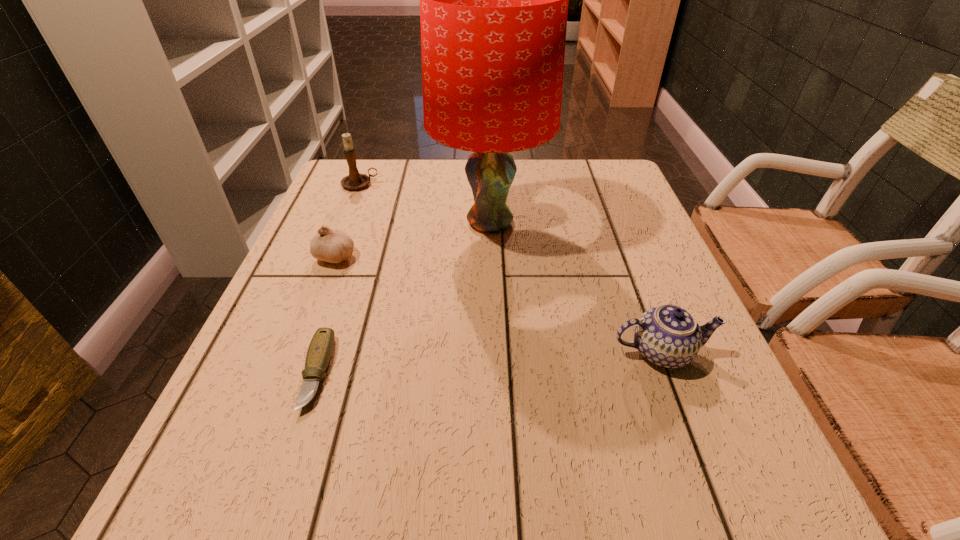
Locate an element on the screen. free space at the left edge of the desktop is located at coordinates (235, 397).

Identify the location of vacant space at the right edge of the desktop. (706, 407).

Where is `free space at the far left corner`? free space at the far left corner is located at coordinates (327, 191).

Locate an element on the screen. Image resolution: width=960 pixels, height=540 pixels. vacant space at the near left corner is located at coordinates (180, 494).

You are a GUI agent. You are given a task and a screenshot of the screen. Output one action in this format:
    pyautogui.click(x=<x>, y=<y>)
    Task: Click on the vacant area at the far right corner of the desktop
    The width and height of the screenshot is (960, 540).
    Given the screenshot: What is the action you would take?
    pyautogui.click(x=594, y=204)

Where is `vacant space that's between the pocketknife and the candle holder`? This screenshot has height=540, width=960. vacant space that's between the pocketknife and the candle holder is located at coordinates (339, 279).

Find the location of a particular element. vacant space that's between the third shortest object and the fourth object from left to right is located at coordinates (575, 287).

Identify the location of free spot between the second object from right to left and the second shortest object. This screenshot has width=960, height=540. (413, 239).

The image size is (960, 540). Find the location of `blank region between the garlic and the pocketknife`. blank region between the garlic and the pocketknife is located at coordinates (326, 314).

Where is `unoccupied area between the lampshade and the shortest object`? unoccupied area between the lampshade and the shortest object is located at coordinates (403, 298).